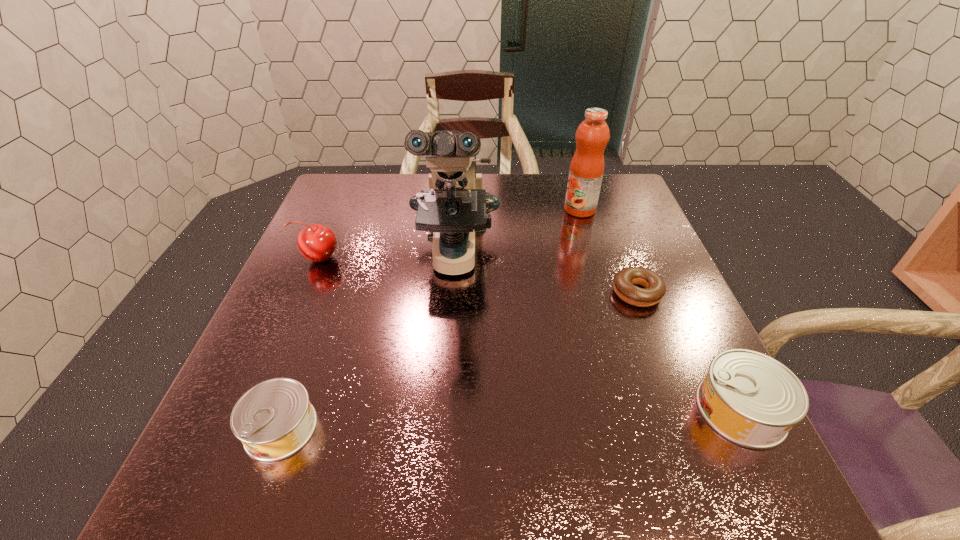
This screenshot has height=540, width=960. In order to click on vacant space at the right edge of the desktop in this screenshot , I will do `click(649, 235)`.

The height and width of the screenshot is (540, 960). In the image, there is a desktop. What are the coordinates of `blank space at the far left corner` in the screenshot? It's located at (355, 181).

This screenshot has width=960, height=540. In order to click on vacant space at the far right corner of the desktop in this screenshot , I will do `click(636, 205)`.

Where is `vacant space at the near right corner of the desktop`? This screenshot has width=960, height=540. vacant space at the near right corner of the desktop is located at coordinates (701, 421).

The image size is (960, 540). What are the coordinates of `free space that is in between the third object from left to right and the fourth tallest object` in the screenshot? It's located at (598, 333).

Locate an element on the screen. The image size is (960, 540). free space between the cherry and the shortest object is located at coordinates (478, 275).

The image size is (960, 540). Identify the location of free space between the third shortest object and the doughnut. (689, 351).

In order to click on empty space between the fruit juice and the fourth object from right to left in this screenshot , I will do (517, 233).

The width and height of the screenshot is (960, 540). Find the location of `unoccupied position between the third tallest object and the left can`. unoccupied position between the third tallest object and the left can is located at coordinates (300, 343).

This screenshot has height=540, width=960. What are the coordinates of `empty space between the shortest object and the fourth shortest object` in the screenshot? It's located at (478, 275).